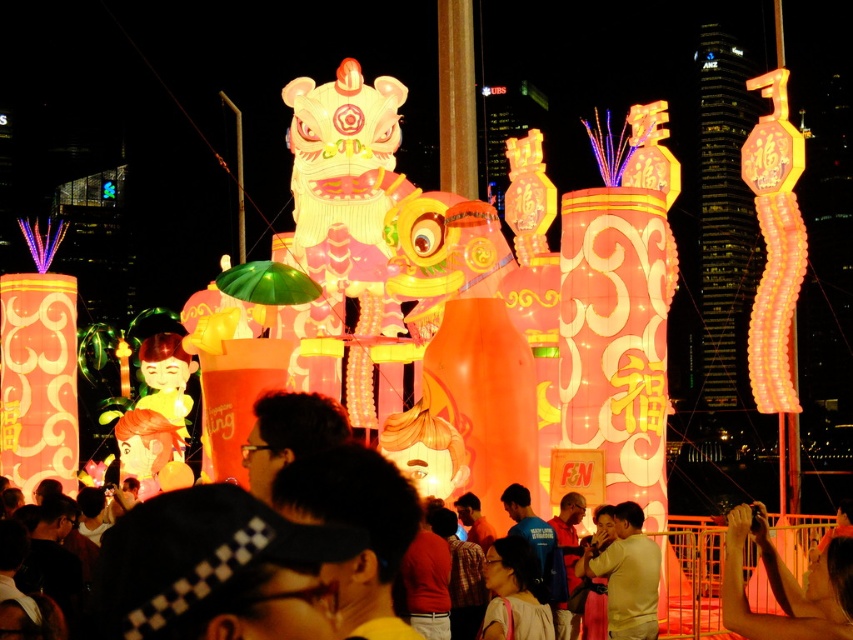
You are a photographer at the lantern festival. You want to capture a photo of both the smooth skin arm at center and the matte pink dress at center. Which object should you focus on first if you want to ensure both are in the frame without moving the camera?

The smooth skin arm at center is wider than the matte pink dress at center. To include both in the frame, focus on the wider object first, which is the smooth skin arm at center, then adjust the framing to include the matte pink dress at center.

You are a photographer at the lantern festival and want to take a photo of the smooth skin arm at center and the matte pink dress at center. Which object should you focus on first if you want to capture both in the same frame without moving the camera?

The smooth skin arm at center is much taller than the matte pink dress at center, so you should focus on the smooth skin arm at center first to ensure it fits within the frame.

You are a photographer at the lantern festival. You want to capture a photo of the smooth skin arm at center and the matte pink dress at center. Which object should you zoom in on to ensure both are in focus without moving the camera?

The smooth skin arm at center is larger in size than the matte pink dress at center, so you should zoom in on the smooth skin arm at center to ensure both are in focus.